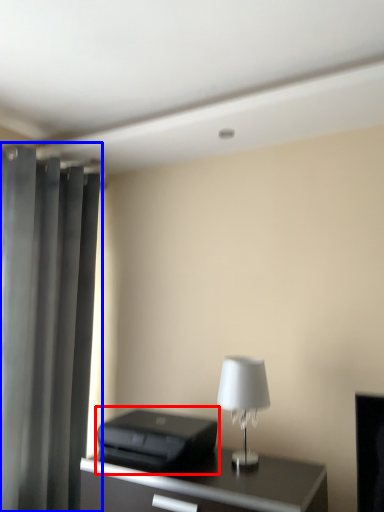
Question: Among these objects, which one is nearest to the camera, printer (highlighted by a red box) or curtain (highlighted by a blue box)?

Choices:
 (A) printer
 (B) curtain

Answer: (A)